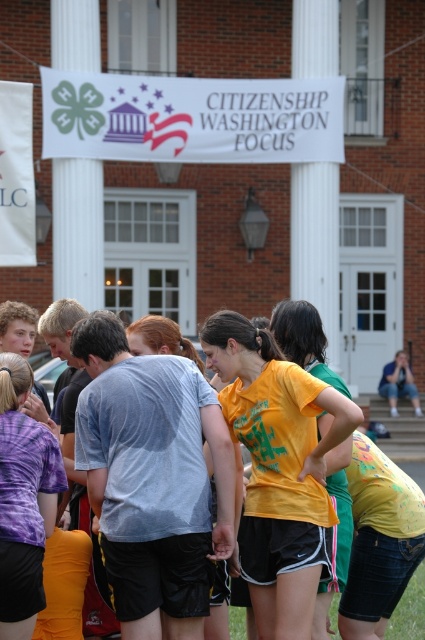
Which is behind, point (280, 474) or point (64, 221)?

Point (64, 221)

Is yellow matte t-shirt at center taller than white smooth column at upper left?

Yes, yellow matte t-shirt at center is taller than white smooth column at upper left.

The width and height of the screenshot is (425, 640). Describe the element at coordinates (277, 468) in the screenshot. I see `yellow matte t-shirt at center` at that location.

At what (x,y) coordinates should I click in order to perform the action: click on yellow matte t-shirt at center. Please return your answer as a coordinate pair (x, y). The height and width of the screenshot is (640, 425). Looking at the image, I should click on (277, 468).

Who is taller, white smooth column at center or white smooth column at upper left?

With more height is white smooth column at center.

This screenshot has width=425, height=640. I want to click on white smooth column at center, so click(316, 243).

I want to click on white smooth column at center, so click(316, 243).

Is purple tie-dye shirt at lower left smaller than white smooth column at upper left?

Incorrect, purple tie-dye shirt at lower left is not smaller in size than white smooth column at upper left.

Based on the photo, which is more to the right, purple tie-dye shirt at lower left or white smooth column at upper left?

purple tie-dye shirt at lower left

Is point (14, 422) positioned behind point (61, 216)?

No, (14, 422) is in front of (61, 216).

At what (x,y) coordinates should I click in order to perform the action: click on purple tie-dye shirt at lower left. Please return your answer as a coordinate pair (x, y). This screenshot has height=640, width=425. Looking at the image, I should click on (23, 500).